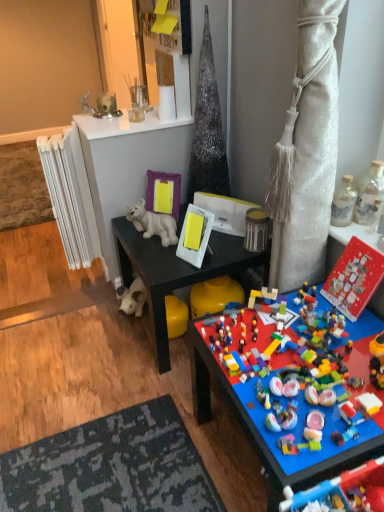
Question: Considering the relative sizes of multicolored plastic lego pieces at lower right, the 2th toy when ordered from bottom to top, and metallic silver canister at upper right, the 4th toy ordered from the bottom, in the image provided, is multicolored plastic lego pieces at lower right, the 2th toy when ordered from bottom to top, smaller than metallic silver canister at upper right, the 4th toy ordered from the bottom,?

Choices:
 (A) no
 (B) yes

Answer: (A)

Question: Considering the relative sizes of multicolored plastic lego pieces at lower right, the 2th toy when ordered from bottom to top, and metallic silver canister at upper right, the 4th toy ordered from the bottom, in the image provided, is multicolored plastic lego pieces at lower right, the 2th toy when ordered from bottom to top, thinner than metallic silver canister at upper right, the 4th toy ordered from the bottom,?

Choices:
 (A) yes
 (B) no

Answer: (B)

Question: Is multicolored plastic lego pieces at lower right, the 2th toy when ordered from bottom to top, wider than metallic silver canister at upper right, the 4th toy ordered from the bottom?

Choices:
 (A) no
 (B) yes

Answer: (B)

Question: Does multicolored plastic lego pieces at lower right, which is counted as the seventh toy, starting from the top, have a larger size compared to metallic silver canister at upper right, which is counted as the 5th toy, starting from the top?

Choices:
 (A) no
 (B) yes

Answer: (B)

Question: Is multicolored plastic lego pieces at lower right, which is counted as the seventh toy, starting from the top, looking in the opposite direction of metallic silver canister at upper right, which is counted as the 5th toy, starting from the top?

Choices:
 (A) yes
 (B) no

Answer: (B)

Question: Considering the relative positions of metallic silver candlestick at upper center, the first toy from the top, and metallic silver canister at upper right, the 4th toy ordered from the bottom, in the image provided, is metallic silver candlestick at upper center, the first toy from the top, to the left or to the right of metallic silver canister at upper right, the 4th toy ordered from the bottom,?

Choices:
 (A) right
 (B) left

Answer: (B)

Question: Looking at their shapes, would you say metallic silver candlestick at upper center, the first toy from the top, is wider or thinner than metallic silver canister at upper right, the 4th toy ordered from the bottom?

Choices:
 (A) thin
 (B) wide

Answer: (B)

Question: Considering their positions, is metallic silver candlestick at upper center, the eighth toy from the bottom, located in front of or behind metallic silver canister at upper right, the 4th toy ordered from the bottom?

Choices:
 (A) behind
 (B) front

Answer: (A)

Question: Do you think metallic silver candlestick at upper center, the first toy from the top, is within metallic silver canister at upper right, the 4th toy ordered from the bottom, or outside of it?

Choices:
 (A) inside
 (B) outside

Answer: (B)

Question: In terms of width, does white plastic picture frame at center, which is the second picture frame from back to front, look wider or thinner when compared to purple matte picture frame at upper center, which is the first picture frame from left to right?

Choices:
 (A) thin
 (B) wide

Answer: (B)

Question: From the image's perspective, is white plastic picture frame at center, placed as the second picture frame when sorted from top to bottom, above or below purple matte picture frame at upper center, the first picture frame positioned from the back?

Choices:
 (A) below
 (B) above

Answer: (A)

Question: Based on their sizes in the image, would you say white plastic picture frame at center, the 1th picture frame positioned from the right, is bigger or smaller than purple matte picture frame at upper center, which is counted as the second picture frame, starting from the right?

Choices:
 (A) big
 (B) small

Answer: (A)

Question: In terms of height, does white plastic picture frame at center, the 1th picture frame positioned from the right, look taller or shorter compared to purple matte picture frame at upper center, which is the 2th picture frame in bottom-to-top order?

Choices:
 (A) short
 (B) tall

Answer: (A)

Question: From a real-world perspective, is multicolored plastic lego pieces at lower right, which is counted as the seventh toy, starting from the top, positioned above or below black matte desk at center?

Choices:
 (A) below
 (B) above

Answer: (A)

Question: In terms of width, does multicolored plastic lego pieces at lower right, which is counted as the seventh toy, starting from the top, look wider or thinner when compared to black matte desk at center?

Choices:
 (A) thin
 (B) wide

Answer: (A)